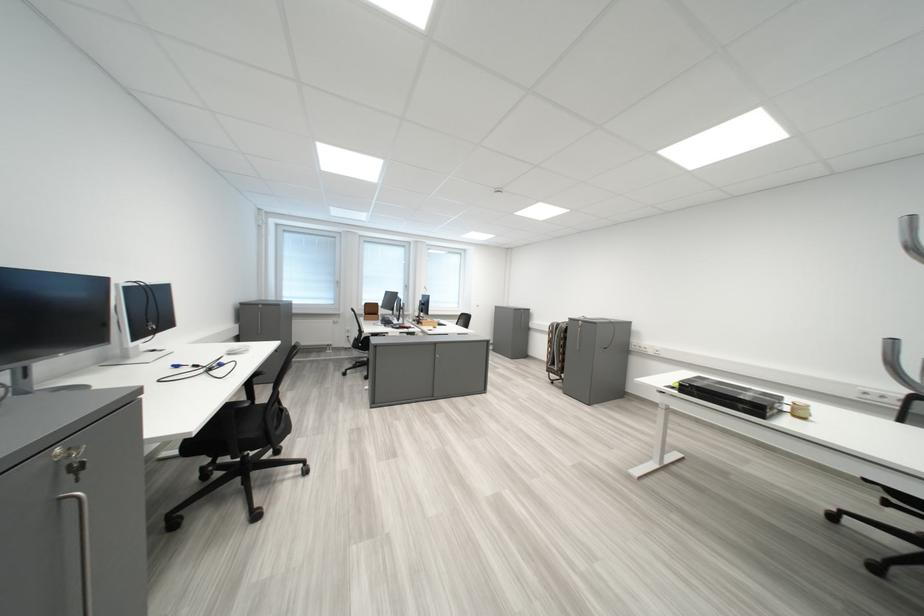
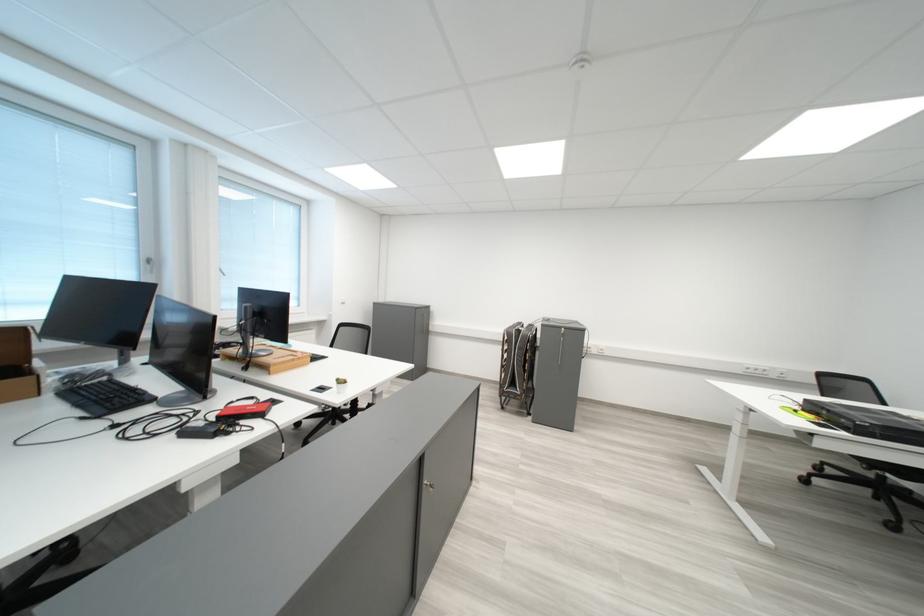
Locate, in the second image, the point that corresponds to point (434, 325) in the first image.

(277, 369)